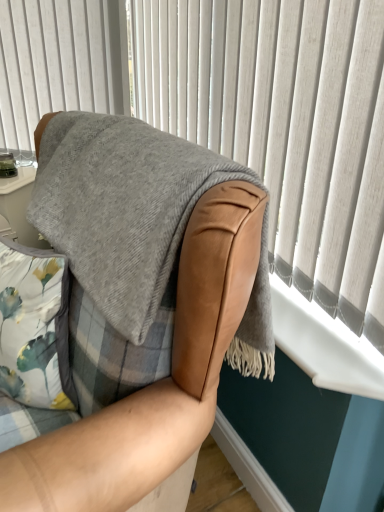
Question: Does white plastic window sill at lower right have a greater height compared to leather armchair at center?

Choices:
 (A) yes
 (B) no

Answer: (B)

Question: Is the position of white plastic window sill at lower right more distant than that of leather armchair at center?

Choices:
 (A) yes
 (B) no

Answer: (A)

Question: Does white plastic window sill at lower right have a smaller size compared to leather armchair at center?

Choices:
 (A) yes
 (B) no

Answer: (A)

Question: Is white plastic window sill at lower right oriented towards leather armchair at center?

Choices:
 (A) no
 (B) yes

Answer: (B)

Question: Considering the relative sizes of white plastic window sill at lower right and leather armchair at center in the image provided, is white plastic window sill at lower right wider than leather armchair at center?

Choices:
 (A) no
 (B) yes

Answer: (A)

Question: In terms of size, does white plastic window sill at lower right appear bigger or smaller than gray woolen blanket at upper right?

Choices:
 (A) small
 (B) big

Answer: (A)

Question: Is white plastic window sill at lower right to the left or to the right of gray woolen blanket at upper right in the image?

Choices:
 (A) right
 (B) left

Answer: (A)

Question: From the image's perspective, is white plastic window sill at lower right above or below gray woolen blanket at upper right?

Choices:
 (A) below
 (B) above

Answer: (A)

Question: In the image, is white plastic window sill at lower right positioned in front of or behind gray woolen blanket at upper right?

Choices:
 (A) behind
 (B) front

Answer: (A)

Question: From the image's perspective, relative to gray woolen blanket at upper right, is leather armchair at center above or below?

Choices:
 (A) above
 (B) below

Answer: (B)

Question: Is point (64, 433) positioned closer to the camera than point (155, 92)?

Choices:
 (A) closer
 (B) farther

Answer: (A)

Question: Based on their positions, is leather armchair at center located to the left or right of gray woolen blanket at upper right?

Choices:
 (A) right
 (B) left

Answer: (B)

Question: Is leather armchair at center situated inside gray woolen blanket at upper right or outside?

Choices:
 (A) outside
 (B) inside

Answer: (A)

Question: Considering the positions of leather armchair at center and white plastic window sill at lower right in the image, is leather armchair at center taller or shorter than white plastic window sill at lower right?

Choices:
 (A) tall
 (B) short

Answer: (A)

Question: Is point (69, 480) closer or farther from the camera than point (364, 377)?

Choices:
 (A) farther
 (B) closer

Answer: (B)